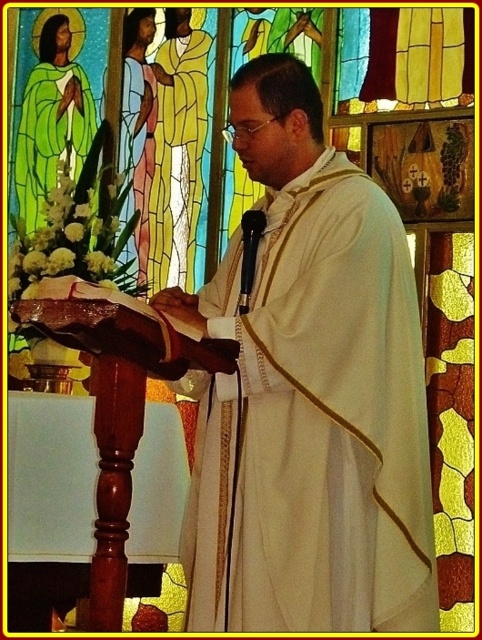
Between white matte robe at center and green matte robe at upper left, which one has less height?

Standing shorter between the two is green matte robe at upper left.

Describe the element at coordinates (308, 394) in the screenshot. Image resolution: width=482 pixels, height=640 pixels. I see `white matte robe at center` at that location.

Which is in front, point (277, 403) or point (94, 125)?

Point (277, 403)

This screenshot has height=640, width=482. Find the location of `white matte robe at center`. white matte robe at center is located at coordinates (308, 394).

Is polished wood pulpit at center above matte gold robe at center?

No, polished wood pulpit at center is not above matte gold robe at center.

Which is behind, point (35, 314) or point (135, 83)?

Point (135, 83)

Between point (90, 342) and point (131, 93), which one is positioned behind?

Positioned behind is point (131, 93).

Find the location of a particular element. The width and height of the screenshot is (482, 640). polished wood pulpit at center is located at coordinates (119, 406).

Is green matte robe at upper left shorter than matte gold robe at center?

In fact, green matte robe at upper left may be taller than matte gold robe at center.

Consider the image. Does green matte robe at upper left appear over matte gold robe at center?

Correct, green matte robe at upper left is located above matte gold robe at center.

The width and height of the screenshot is (482, 640). What do you see at coordinates (51, 132) in the screenshot?
I see `green matte robe at upper left` at bounding box center [51, 132].

The height and width of the screenshot is (640, 482). Identify the location of green matte robe at upper left. 51,132.